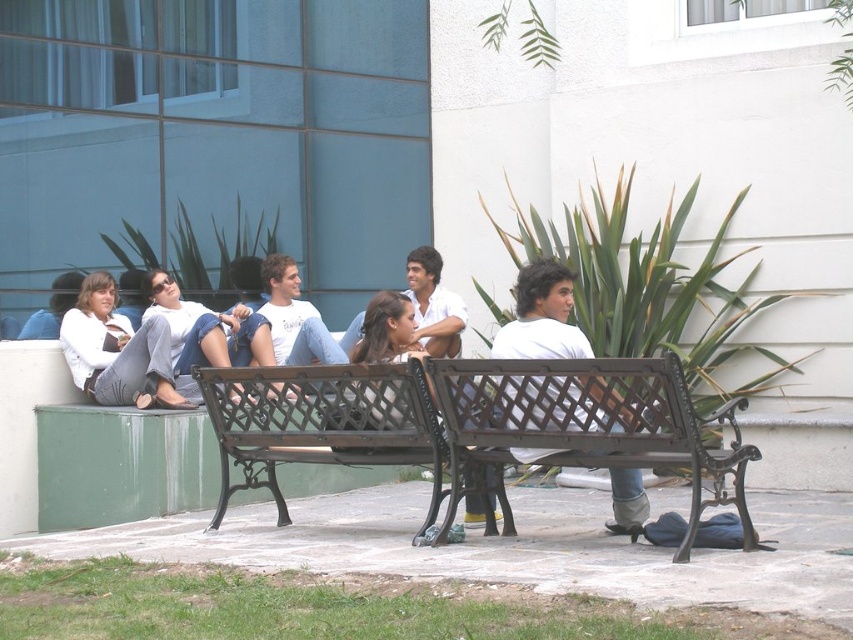
Question: Which of the following is the farthest from the observer?

Choices:
 (A) (474, 365)
 (B) (80, 339)

Answer: (B)

Question: From the image, what is the correct spatial relationship of matte white shirt at left in relation to white matte shirt at center?

Choices:
 (A) left
 (B) right

Answer: (A)

Question: Does dark brown wood bench at center have a larger size compared to matte white shirt at left?

Choices:
 (A) yes
 (B) no

Answer: (A)

Question: Among these points, which one is farthest from the camera?

Choices:
 (A) (682, 433)
 (B) (109, 296)
 (C) (648, 512)

Answer: (B)

Question: Considering the real-world distances, which object is closest to the white matte shirt at center?

Choices:
 (A) matte white shirt at left
 (B) dark brown wood bench at center

Answer: (B)

Question: Is dark brown wood bench at center further to camera compared to matte white shirt at left?

Choices:
 (A) yes
 (B) no

Answer: (B)